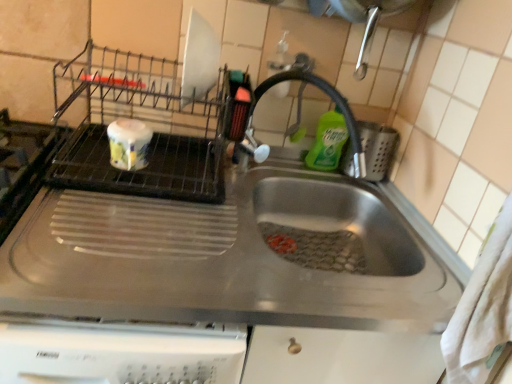
Question: Is green liquid soap at upper right positioned behind satin nickel faucet at center?

Choices:
 (A) yes
 (B) no

Answer: (A)

Question: Could you tell me if green liquid soap at upper right is facing satin nickel faucet at center?

Choices:
 (A) yes
 (B) no

Answer: (A)

Question: Considering the relative sizes of green liquid soap at upper right and satin nickel faucet at center in the image provided, is green liquid soap at upper right bigger than satin nickel faucet at center?

Choices:
 (A) yes
 (B) no

Answer: (B)

Question: From the image's perspective, is green liquid soap at upper right below satin nickel faucet at center?

Choices:
 (A) yes
 (B) no

Answer: (B)

Question: Could satin nickel faucet at center be considered to be inside green liquid soap at upper right?

Choices:
 (A) no
 (B) yes

Answer: (A)

Question: Is green liquid soap at upper right smaller than satin nickel faucet at center?

Choices:
 (A) no
 (B) yes

Answer: (B)

Question: From the image's perspective, is stainless steel sink at center on green liquid soap at upper right?

Choices:
 (A) no
 (B) yes

Answer: (A)

Question: Does stainless steel sink at center come in front of green liquid soap at upper right?

Choices:
 (A) yes
 (B) no

Answer: (A)

Question: Considering the relative sizes of stainless steel sink at center and green liquid soap at upper right in the image provided, is stainless steel sink at center bigger than green liquid soap at upper right?

Choices:
 (A) no
 (B) yes

Answer: (B)

Question: Is stainless steel sink at center far away from green liquid soap at upper right?

Choices:
 (A) no
 (B) yes

Answer: (A)

Question: Is stainless steel sink at center positioned with its back to green liquid soap at upper right?

Choices:
 (A) yes
 (B) no

Answer: (B)

Question: Does stainless steel sink at center have a greater width compared to green liquid soap at upper right?

Choices:
 (A) no
 (B) yes

Answer: (B)

Question: From the image's perspective, is green liquid soap at upper right located beneath stainless steel sink at center?

Choices:
 (A) no
 (B) yes

Answer: (A)